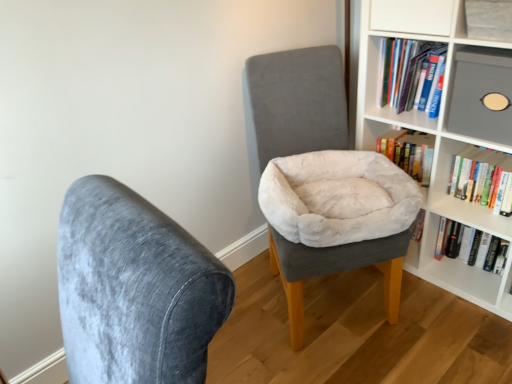
Measure the distance between matte gray shelf at upper right, which appears as the second shelf when ordered from the bottom, and camera.

The distance of matte gray shelf at upper right, which appears as the second shelf when ordered from the bottom, from camera is 4.48 feet.

Describe the element at coordinates (294, 103) in the screenshot. The image size is (512, 384). I see `velvet gray chair at center, marked as the 1th chair in a back-to-front arrangement` at that location.

Image resolution: width=512 pixels, height=384 pixels. Find the location of `matte gray shelf at upper right, which is the second shelf in top-to-bottom order`. matte gray shelf at upper right, which is the second shelf in top-to-bottom order is located at coordinates (481, 94).

Describe the element at coordinates (481, 94) in the screenshot. I see `matte gray shelf at upper right, which is the second shelf in top-to-bottom order` at that location.

Measure the distance between point [499,157] and camera.

Point [499,157] is 1.80 meters away from camera.

This screenshot has height=384, width=512. I want to click on hardcover book at upper right, the 3th book when ordered from bottom to top, so click(x=409, y=152).

Can we say hardcover book at right, the third book positioned from the top, lies outside velvet gray chair at center, the 2th chair positioned from the left?

Yes, hardcover book at right, the third book positioned from the top, is located beyond the bounds of velvet gray chair at center, the 2th chair positioned from the left.

How much distance is there between hardcover book at right, the third book positioned from the top, and velvet gray chair at center, which ranks as the 1th chair in right-to-left order?

83.33 centimeters.

Considering the sizes of objects hardcover book at right, the 1th book ordered from the bottom, and velvet gray chair at center, the 2th chair positioned from the left, in the image provided, who is thinner, hardcover book at right, the 1th book ordered from the bottom, or velvet gray chair at center, the 2th chair positioned from the left,?

Thinner between the two is hardcover book at right, the 1th book ordered from the bottom.

What's the angular difference between hardcover book at right, the 1th book ordered from the bottom, and velvet gray chair at center, which ranks as the 1th chair in right-to-left order,'s facing directions?

hardcover book at right, the 1th book ordered from the bottom, and velvet gray chair at center, which ranks as the 1th chair in right-to-left order, are facing 59.7 degrees away from each other.

Would you consider velvet gray chair at center, the 2th chair positioned from the left, to be distant from matte gray shelf at upper right, which appears as the second shelf when ordered from the bottom?

No, velvet gray chair at center, the 2th chair positioned from the left, is not far from matte gray shelf at upper right, which appears as the second shelf when ordered from the bottom.

From the picture: Is the depth of velvet gray chair at center, the 2th chair positioned from the left, greater than that of matte gray shelf at upper right, which appears as the second shelf when ordered from the bottom?

No, velvet gray chair at center, the 2th chair positioned from the left, is closer to the viewer.

Based on the photo, considering the sizes of objects velvet gray chair at center, marked as the 1th chair in a back-to-front arrangement, and matte gray shelf at upper right, which appears as the 1th shelf when viewed from the top, in the image provided, who is smaller, velvet gray chair at center, marked as the 1th chair in a back-to-front arrangement, or matte gray shelf at upper right, which appears as the 1th shelf when viewed from the top,?

matte gray shelf at upper right, which appears as the 1th shelf when viewed from the top.

Between velvet gray chair at center, the second chair in the front-to-back sequence, and matte gray shelf at upper right, which appears as the second shelf when ordered from the bottom, which one appears on the right side from the viewer's perspective?

From the viewer's perspective, matte gray shelf at upper right, which appears as the second shelf when ordered from the bottom, appears more on the right side.

Consider the image. Is hardcover book at upper right, which is counted as the 2th book, starting from the bottom, surrounded by velvet gray chair at center, marked as the 1th chair in a back-to-front arrangement?

That's incorrect, hardcover book at upper right, which is counted as the 2th book, starting from the bottom, is not inside velvet gray chair at center, marked as the 1th chair in a back-to-front arrangement.

Are velvet gray chair at center, which ranks as the 1th chair in right-to-left order, and hardcover book at upper right, the second book viewed from the top, beside each other?

No.

Can you confirm if velvet gray chair at center, the second chair in the front-to-back sequence, is thinner than hardcover book at upper right, the second book viewed from the top?

Incorrect, the width of velvet gray chair at center, the second chair in the front-to-back sequence, is not less than that of hardcover book at upper right, the second book viewed from the top.

Is velvet gray chair at center, the 2th chair positioned from the left, aimed at hardcover book at upper right, the second book viewed from the top?

No, velvet gray chair at center, the 2th chair positioned from the left, is not facing towards hardcover book at upper right, the second book viewed from the top.

From the image's perspective, relative to beige plush bean bag chair at center, is hardcover book at upper right, the first book when ordered from top to bottom, above or below?

hardcover book at upper right, the first book when ordered from top to bottom, is above beige plush bean bag chair at center.

Considering the relative sizes of hardcover book at upper right, the 3th book when ordered from bottom to top, and beige plush bean bag chair at center in the image provided, is hardcover book at upper right, the 3th book when ordered from bottom to top, shorter than beige plush bean bag chair at center?

In fact, hardcover book at upper right, the 3th book when ordered from bottom to top, may be taller than beige plush bean bag chair at center.

Looking at this image, is hardcover book at upper right, the 3th book when ordered from bottom to top, wider than beige plush bean bag chair at center?

No.

Is hardcover book at upper right, the 3th book when ordered from bottom to top, surrounding beige plush bean bag chair at center?

Actually, beige plush bean bag chair at center is outside hardcover book at upper right, the 3th book when ordered from bottom to top.

Considering the points (349, 229) and (510, 318), which point is in front, point (349, 229) or point (510, 318)?

Point (349, 229)

In terms of width, does beige plush bean bag chair at center look wider or thinner when compared to white matte bookcase at upper right?

Considering their sizes, beige plush bean bag chair at center looks broader than white matte bookcase at upper right.

From a real-world perspective, is beige plush bean bag chair at center under white matte bookcase at upper right?

Yes, from a real-world perspective, beige plush bean bag chair at center is under white matte bookcase at upper right.

Between hardcover book at upper right, the second book viewed from the top, and white matte bookcase at upper right, which one has larger size?

Bigger between the two is white matte bookcase at upper right.

From a real-world perspective, which object stands above the other?

white matte bookcase at upper right, from a real-world perspective.

Between point (507, 205) and point (368, 21), which one is positioned in front?

The point (368, 21) is more forward.

Is white matte bookcase at upper right touching hardcover book at upper right, the second book viewed from the top?

No.

In the scene shown: From a real-world perspective, between white matte bookcase at upper right and hardcover book at upper right, which is counted as the 2th book, starting from the bottom, who is vertically lower?

From a 3D spatial view, hardcover book at upper right, which is counted as the 2th book, starting from the bottom, is below.

How distant is white matte bookcase at upper right from hardcover book at upper right, which is counted as the 2th book, starting from the bottom?

They are 8.65 inches apart.

Is white matte bookcase at upper right shorter than hardcover book at upper right, which is counted as the 2th book, starting from the bottom?

Incorrect, the height of white matte bookcase at upper right does not fall short of that of hardcover book at upper right, which is counted as the 2th book, starting from the bottom.

Identify the location of book below the velvet gray chair at center, the 2th chair positioned from the left (from the image's perspective). 471,246.

The height and width of the screenshot is (384, 512). In order to click on chair that is the 1st one when counting forward from the matte gray shelf at upper right, which appears as the 1th shelf when viewed from the top in this screenshot , I will do `click(294, 103)`.

Considering their positions, is matte gray shelf at upper right, which is the second shelf in top-to-bottom order, positioned closer to beige plush bean bag chair at center than hardcover book at right, the 1th book ordered from the bottom?

matte gray shelf at upper right, which is the second shelf in top-to-bottom order, is closer to beige plush bean bag chair at center.

Considering their positions, is beige plush bean bag chair at center positioned closer to hardcover book at right, the third book positioned from the top, than white matte bookcase at upper right?

white matte bookcase at upper right is closer to hardcover book at right, the third book positioned from the top.

Based on their spatial positions, is beige plush bean bag chair at center or matte gray shelf at upper right, which is the second shelf in top-to-bottom order, further from velvet gray chair at center, the second chair in the front-to-back sequence?

matte gray shelf at upper right, which is the second shelf in top-to-bottom order, lies further to velvet gray chair at center, the second chair in the front-to-back sequence, than the other object.

From the image, which object appears to be farther from matte gray shelf at upper right, which is the second shelf in top-to-bottom order, velvet gray chair at center, marked as the 1th chair in a back-to-front arrangement, or hardcover book at upper right, which is counted as the 2th book, starting from the bottom?

velvet gray chair at center, marked as the 1th chair in a back-to-front arrangement, lies further to matte gray shelf at upper right, which is the second shelf in top-to-bottom order, than the other object.

When comparing their distances from velvet gray chair at center, placed as the first chair when sorted from front to back, does hardcover book at right, the 1th book ordered from the bottom, or beige plush bean bag chair at center seem further?

hardcover book at right, the 1th book ordered from the bottom, lies further to velvet gray chair at center, placed as the first chair when sorted from front to back, than the other object.

When comparing their distances from velvet gray chair at center, positioned as the second chair in right-to-left order, does velvet gray chair at center, marked as the 1th chair in a back-to-front arrangement, or hardcover book at upper right, the second book viewed from the top, seem closer?

velvet gray chair at center, marked as the 1th chair in a back-to-front arrangement.

Looking at the image, which one is located further to velvet gray chair at center, the 2th chair positioned from the left, matte gray shelf at upper right, which is the second shelf in top-to-bottom order, or velvet gray chair at center, positioned as the 1th chair in left-to-right order?

Among the two, velvet gray chair at center, positioned as the 1th chair in left-to-right order, is located further to velvet gray chair at center, the 2th chair positioned from the left.

Looking at this image, from the image, which object appears to be nearer to beige plush bean bag chair at center, velvet gray chair at center, acting as the second chair starting from the back, or matte gray shelf at upper right, which is the second shelf in top-to-bottom order?

The object closer to beige plush bean bag chair at center is matte gray shelf at upper right, which is the second shelf in top-to-bottom order.

Find the location of `shelf situated between velvet gray chair at center, which ranks as the 1th chair in right-to-left order, and matte gray shelf at upper right, which is the second shelf in top-to-bottom order, from left to right`. shelf situated between velvet gray chair at center, which ranks as the 1th chair in right-to-left order, and matte gray shelf at upper right, which is the second shelf in top-to-bottom order, from left to right is located at coordinates (485, 20).

The height and width of the screenshot is (384, 512). Identify the location of bookcase located between beige plush bean bag chair at center and hardcover book at upper right, which is counted as the 2th book, starting from the bottom, in the left-right direction. (435, 137).

Image resolution: width=512 pixels, height=384 pixels. Identify the location of bookcase between velvet gray chair at center, which ranks as the 1th chair in right-to-left order, and hardcover book at right, the third book positioned from the top. (435, 137).

Where is `bean bag chair between matte gray shelf at upper right, which appears as the 1th shelf when viewed from the top, and hardcover book at right, the 1th book ordered from the bottom, in the vertical direction`? bean bag chair between matte gray shelf at upper right, which appears as the 1th shelf when viewed from the top, and hardcover book at right, the 1th book ordered from the bottom, in the vertical direction is located at coordinates (336, 197).